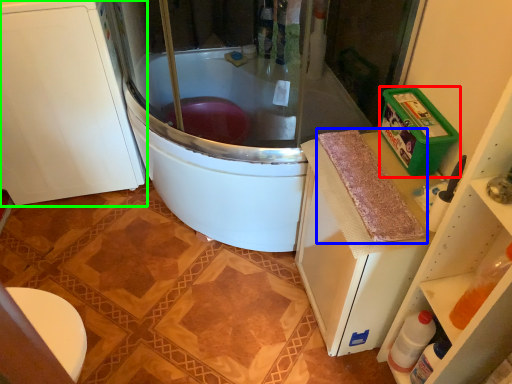
Question: Considering the real-world distances, which object is farthest from appliance (highlighted by a red box)? material (highlighted by a blue box) or cabinetry (highlighted by a green box)?

Choices:
 (A) material
 (B) cabinetry

Answer: (B)